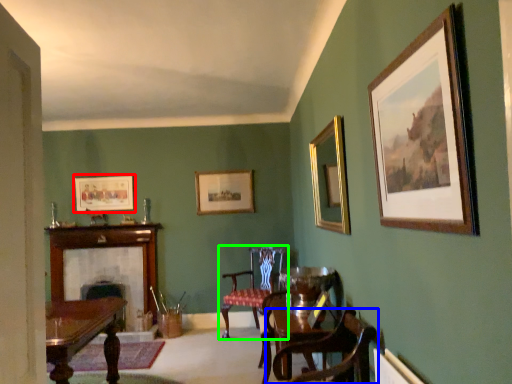
Question: Estimate the real-world distances between objects in this image. Which object is closer to picture frame (highlighted by a red box), chair (highlighted by a blue box) or chair (highlighted by a green box)?

Choices:
 (A) chair
 (B) chair

Answer: (B)